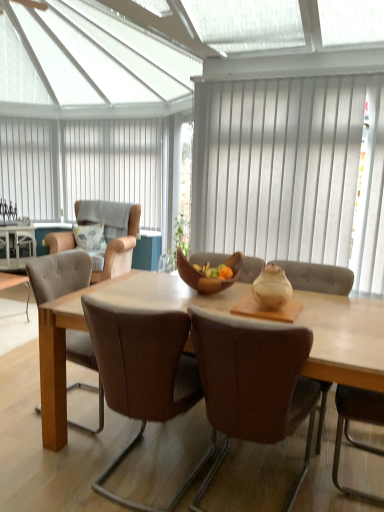
Measure the distance between point (164, 361) and camera.

The depth of point (164, 361) is 5.38 feet.

I want to click on white textured curtain at center, placed as the first curtain when sorted from front to back, so click(x=292, y=172).

The height and width of the screenshot is (512, 384). What are the coordinates of `brown leather chair at left, the 2th chair in the back-to-front sequence` in the screenshot? It's located at (58, 274).

Describe the element at coordinates (58, 274) in the screenshot. I see `brown leather chair at left, the 2th chair in the back-to-front sequence` at that location.

The image size is (384, 512). Describe the element at coordinates (18, 246) in the screenshot. I see `brown leather table at lower left` at that location.

Describe the element at coordinates (120, 251) in the screenshot. I see `beige fabric armchair at left, positioned as the 1th chair in back-to-front order` at that location.

Locate an element on the screen. beige fabric armchair at left, which ranks as the 4th chair in front-to-back order is located at coordinates (120, 251).

Locate an element on the screen. The image size is (384, 512). brown wooden bowl at center is located at coordinates (208, 278).

How different are the orientations of white vertical blinds at upper center, positioned as the 1th curtain in back-to-front order, and brown leather chair at left, the third chair viewed from the front, in degrees?

There is a 85-degree angle between the facing directions of white vertical blinds at upper center, positioned as the 1th curtain in back-to-front order, and brown leather chair at left, the third chair viewed from the front.

Which of these two, white vertical blinds at upper center, marked as the second curtain in a front-to-back arrangement, or brown leather chair at left, the 2th chair in the back-to-front sequence, is bigger?

Bigger between the two is brown leather chair at left, the 2th chair in the back-to-front sequence.

What are the coordinates of `the 2nd chair below the white vertical blinds at upper center, marked as the second curtain in a front-to-back arrangement (from the image's perspective)` in the screenshot? It's located at (58, 274).

Between white vertical blinds at upper center, arranged as the 1th curtain when viewed from the left, and brown leather chair at left, the third chair viewed from the front, which one has smaller width?

With smaller width is white vertical blinds at upper center, arranged as the 1th curtain when viewed from the left.

From a real-world perspective, starting from the white textured curtain at center, placed as the first curtain when sorted from front to back, which chair is the 3rd one below it? Please provide its 2D coordinates.

[(253, 384)]

Is brown leather chair at center, which is the first chair in front-to-back order, at the back of white textured curtain at center, positioned as the 2th curtain in back-to-front order?

No, white textured curtain at center, positioned as the 2th curtain in back-to-front order, is not facing away from brown leather chair at center, which is the first chair in front-to-back order.

Is brown leather chair at left, the 2th chair in the back-to-front sequence, inside the boundaries of white vertical blinds at upper center, arranged as the 1th curtain when viewed from the left, or outside?

brown leather chair at left, the 2th chair in the back-to-front sequence, is located beyond the bounds of white vertical blinds at upper center, arranged as the 1th curtain when viewed from the left.

Is point (65, 253) positioned before point (151, 225)?

Yes, point (65, 253) is in front of point (151, 225).

Does brown leather chair at left, the third chair viewed from the front, turn towards white vertical blinds at upper center, arranged as the 1th curtain when viewed from the left?

No.

Can you tell me how much brown leather chair at left, the third chair viewed from the front, and white vertical blinds at upper center, arranged as the 1th curtain when viewed from the left, differ in facing direction?

85 degrees separate the facing orientations of brown leather chair at left, the third chair viewed from the front, and white vertical blinds at upper center, arranged as the 1th curtain when viewed from the left.

Which object is thinner, light brown wooden table at center or fluffy fabric pillow at upper left?

fluffy fabric pillow at upper left is thinner.

Is light brown wooden table at center outside of fluffy fabric pillow at upper left?

light brown wooden table at center is positioned outside fluffy fabric pillow at upper left.

How different are the orientations of light brown wooden table at center and fluffy fabric pillow at upper left in degrees?

20 degrees separate the facing orientations of light brown wooden table at center and fluffy fabric pillow at upper left.

Is light brown wooden table at center in contact with fluffy fabric pillow at upper left?

There is a gap between light brown wooden table at center and fluffy fabric pillow at upper left.

From a real-world perspective, is brown leather table at lower left positioned under brown wooden bowl at center based on gravity?

Yes, from a real-world perspective, brown leather table at lower left is beneath brown wooden bowl at center.

Based on the photo, would you say brown leather table at lower left is to the left or to the right of brown wooden bowl at center in the picture?

In the image, brown leather table at lower left appears on the left side of brown wooden bowl at center.

Looking at this image, who is bigger, brown leather table at lower left or brown wooden bowl at center?

brown leather table at lower left.

Is there a large distance between brown leather table at lower left and brown wooden bowl at center?

Yes, brown leather table at lower left is far from brown wooden bowl at center.

Could you tell me if light brown wooden table at center is turned towards brown leather chair at center, which is counted as the third chair, starting from the back?

Yes, light brown wooden table at center is aimed at brown leather chair at center, which is counted as the third chair, starting from the back.

Based on their sizes in the image, would you say light brown wooden table at center is bigger or smaller than brown leather chair at center, which is the second chair from front to back?

light brown wooden table at center is bigger than brown leather chair at center, which is the second chair from front to back.

Does white textured curtain at center, positioned as the first curtain in right-to-left order, have a lesser width compared to brown wooden bowl at center?

Correct, the width of white textured curtain at center, positioned as the first curtain in right-to-left order, is less than that of brown wooden bowl at center.

How different are the orientations of white textured curtain at center, placed as the first curtain when sorted from front to back, and brown wooden bowl at center in degrees?

The angular difference between white textured curtain at center, placed as the first curtain when sorted from front to back, and brown wooden bowl at center is 1.75 degrees.

Considering the relative positions of white textured curtain at center, positioned as the 2th curtain in back-to-front order, and brown wooden bowl at center in the image provided, is white textured curtain at center, positioned as the 2th curtain in back-to-front order, to the right of brown wooden bowl at center from the viewer's perspective?

Yes, white textured curtain at center, positioned as the 2th curtain in back-to-front order, is to the right of brown wooden bowl at center.

Who is bigger, white textured curtain at center, placed as the first curtain when sorted from front to back, or brown wooden bowl at center?

white textured curtain at center, placed as the first curtain when sorted from front to back.

You are a GUI agent. You are given a task and a screenshot of the screen. Output one action in this format:
    pyautogui.click(x=<x>, y=<y>)
    Task: Click on the 4th chair located beneath the white vertical blinds at upper center, positioned as the 1th curtain in back-to-front order (from a real-world perspective)
    The width and height of the screenshot is (384, 512).
    Given the screenshot: What is the action you would take?
    pyautogui.click(x=58, y=274)

The height and width of the screenshot is (512, 384). What are the coordinates of `the 3rd chair in front when counting from the white textured curtain at center, positioned as the first curtain in right-to-left order` in the screenshot? It's located at (253, 384).

Consider the image. Estimate the real-world distances between objects in this image. Which object is further from brown leather table at lower left, brown leather chair at center, which is counted as the third chair, starting from the back, or brown leather chair at center, arranged as the 4th chair when viewed from the back?

Among the two, brown leather chair at center, arranged as the 4th chair when viewed from the back, is located further to brown leather table at lower left.

From the image, which object appears to be nearer to brown wooden bowl at center, white vertical blinds at upper center, arranged as the 1th curtain when viewed from the left, or fluffy fabric pillow at upper left?

fluffy fabric pillow at upper left is positioned closer to the anchor brown wooden bowl at center.

Which object lies nearer to the anchor point white vertical blinds at upper center, marked as the second curtain in a front-to-back arrangement, brown leather chair at center, which is counted as the third chair, starting from the back, or brown leather chair at center, which is the first chair in front-to-back order?

The object closer to white vertical blinds at upper center, marked as the second curtain in a front-to-back arrangement, is brown leather chair at center, which is counted as the third chair, starting from the back.

When comparing their distances from white vertical blinds at upper center, positioned as the 1th curtain in back-to-front order, does brown leather table at lower left or brown wooden bowl at center seem further?

The object further to white vertical blinds at upper center, positioned as the 1th curtain in back-to-front order, is brown wooden bowl at center.

Which object lies nearer to the anchor point brown leather chair at left, the third chair viewed from the front, brown leather chair at center, which is the first chair in front-to-back order, or white vertical blinds at upper center, arranged as the 1th curtain when viewed from the left?

brown leather chair at center, which is the first chair in front-to-back order, lies closer to brown leather chair at left, the third chair viewed from the front, than the other object.

Considering their positions, is brown wooden bowl at center positioned further to brown leather chair at center, which is the second chair from front to back, than light brown wooden table at center?

brown wooden bowl at center.

Looking at the image, which one is located closer to white vertical blinds at upper center, marked as the second curtain in a front-to-back arrangement, brown leather table at lower left or white textured curtain at center, the second curtain viewed from the left?

brown leather table at lower left lies closer to white vertical blinds at upper center, marked as the second curtain in a front-to-back arrangement, than the other object.

Considering their positions, is brown leather table at lower left positioned closer to fluffy fabric pillow at upper left than light brown wooden table at center?

Based on the image, brown leather table at lower left appears to be nearer to fluffy fabric pillow at upper left.

Where is `table between brown leather chair at center, arranged as the 4th chair when viewed from the back, and white vertical blinds at upper center, the second curtain positioned from the right, in the front-back direction`? table between brown leather chair at center, arranged as the 4th chair when viewed from the back, and white vertical blinds at upper center, the second curtain positioned from the right, in the front-back direction is located at coordinates (18, 246).

At what (x,y) coordinates should I click in order to perform the action: click on curtain located between brown leather chair at left, the third chair viewed from the front, and beige fabric armchair at left, which ranks as the 4th chair in front-to-back order, in the depth direction. Please return your answer as a coordinate pair (x, y). This screenshot has height=512, width=384. Looking at the image, I should click on (292, 172).

I want to click on bowl between brown leather chair at center, which is the first chair in front-to-back order, and brown leather table at lower left in the front-back direction, so click(208, 278).

Locate an element on the screen. bowl between light brown wooden table at center and white vertical blinds at upper center, positioned as the 1th curtain in back-to-front order, in the front-back direction is located at coordinates (208, 278).